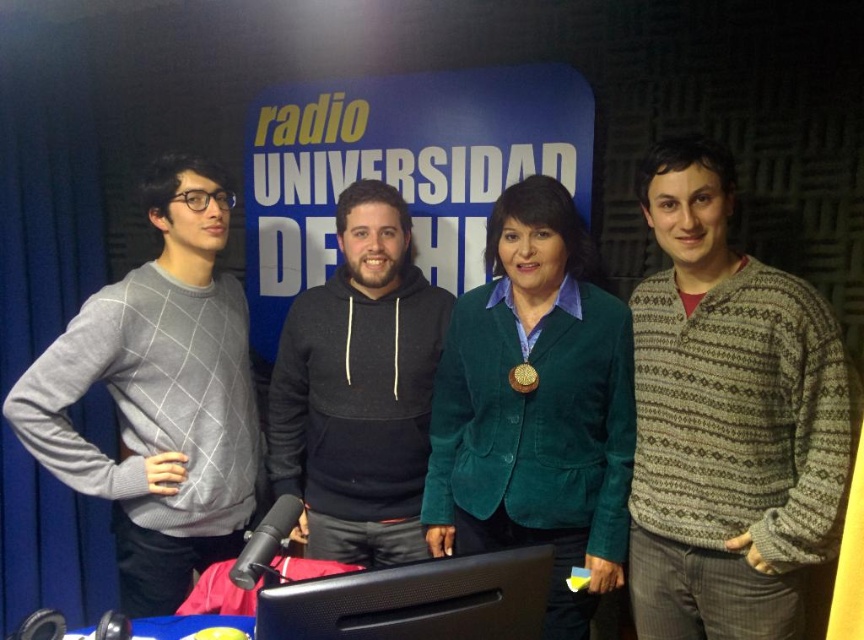
You are a fashion designer observing the radio studio scene. You need to decide which item, the knitted wool sweater at right or the gold shiny medal at center, would require a larger display stand for a fashion show. Based on the scene, which one should you choose?

The knitted wool sweater at right is much taller than the gold shiny medal at center, so you should choose the knitted wool sweater at right for a larger display stand.

You are an interior designer assessing the layout of the radio studio. The green corduroy blazer at center and the gray wool sweater at left are part of the decor. Which item is positioned lower in the studio?

The green corduroy blazer at center is positioned lower than the gray wool sweater at left in the studio.

You are a guest on a university radio show and notice two items of interest in the scene. Which object is positioned more to the right between the knitted wool sweater at right and the gold shiny medal at center?

The knitted wool sweater at right is positioned more to the right than the gold shiny medal at center.